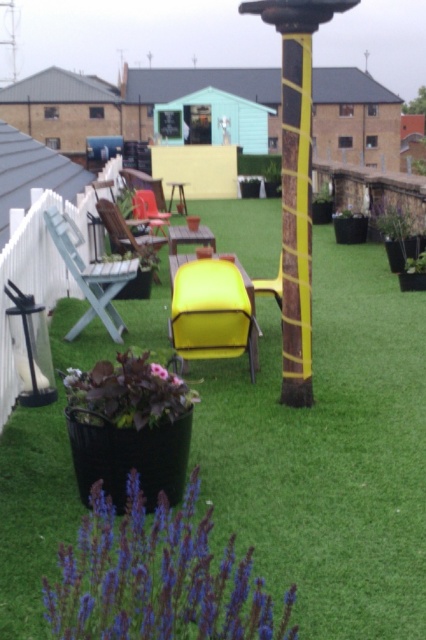
Question: Which point is farther from the camera taking this photo?

Choices:
 (A) (354, 572)
 (B) (192, 285)

Answer: (B)

Question: Does purple matte flower at lower center appear over matte red chair at center?

Choices:
 (A) yes
 (B) no

Answer: (B)

Question: Estimate the real-world distances between objects in this image. Which object is closer to the green artificial grass at center?

Choices:
 (A) wooden chair at center
 (B) yellow painted metal pole at center
 (C) purple matte flower at lower center
 (D) yellow matte chair at center

Answer: (D)

Question: Observing the image, what is the correct spatial positioning of green artificial grass at center in reference to yellow plastic chair at center?

Choices:
 (A) above
 (B) below

Answer: (B)

Question: Among these objects, which one is farthest from the camera?

Choices:
 (A) yellow plastic chair at center
 (B) purple matte flower at lower center
 (C) green artificial grass at center

Answer: (A)

Question: Where is purple matte flower at lower center located in relation to yellow matte chair at center in the image?

Choices:
 (A) left
 (B) right

Answer: (A)